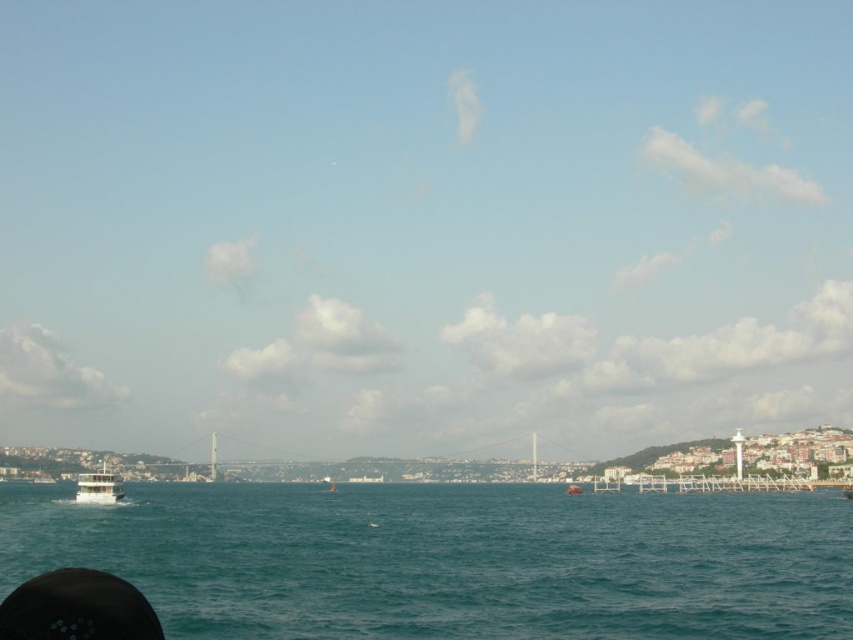
Question: Which is nearer to the white matte boat at lower center?

Choices:
 (A) teal water at lower left
 (B) white glossy ferry at lower left

Answer: (A)

Question: From the image, what is the correct spatial relationship of teal water at lower left in relation to white matte boat at lower center?

Choices:
 (A) right
 (B) left

Answer: (B)

Question: Based on their relative distances, which object is farther from the teal water at lower left?

Choices:
 (A) white matte boat at lower center
 (B) white glossy ferry at lower left

Answer: (A)

Question: Can you confirm if teal water at lower left is thinner than white matte boat at lower center?

Choices:
 (A) yes
 (B) no

Answer: (B)

Question: Is teal water at lower left to the left of white glossy ferry at lower left from the viewer's perspective?

Choices:
 (A) no
 (B) yes

Answer: (A)

Question: Which point is closer to the camera?

Choices:
 (A) (440, 634)
 (B) (107, 486)

Answer: (A)